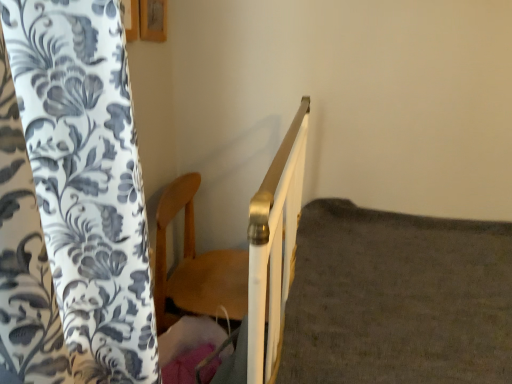
Question: Looking at the image, does white matte bed frame at upper right seem bigger or smaller compared to wooden chair at center?

Choices:
 (A) big
 (B) small

Answer: (A)

Question: From the image's perspective, is white matte bed frame at upper right above or below wooden chair at center?

Choices:
 (A) above
 (B) below

Answer: (B)

Question: Considering the positions of white matte bed frame at upper right and wooden chair at center in the image, is white matte bed frame at upper right wider or thinner than wooden chair at center?

Choices:
 (A) thin
 (B) wide

Answer: (B)

Question: Considering their positions, is wooden chair at center located in front of or behind white matte bed frame at upper right?

Choices:
 (A) front
 (B) behind

Answer: (B)

Question: Based on their sizes in the image, would you say wooden chair at center is bigger or smaller than white matte bed frame at upper right?

Choices:
 (A) small
 (B) big

Answer: (A)

Question: From their relative heights in the image, would you say wooden chair at center is taller or shorter than white matte bed frame at upper right?

Choices:
 (A) tall
 (B) short

Answer: (B)

Question: From the image's perspective, relative to white matte bed frame at upper right, is wooden chair at center above or below?

Choices:
 (A) above
 (B) below

Answer: (A)